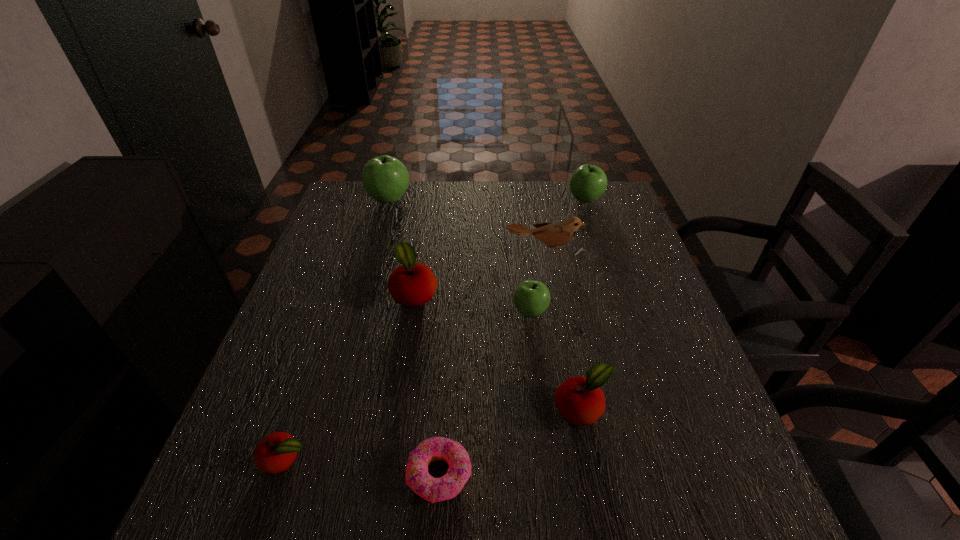
Identify which green apple is the second closest to the pink doughnut. Please provide its 2D coordinates. Your answer should be formatted as a tuple, i.e. [(x, y)], where the tuple contains the x and y coordinates of a point satisfying the conditions above.

[(385, 178)]

At what (x,y) coordinates should I click in order to perform the action: click on red apple that is the closest one to the nearest green apple. Please return your answer as a coordinate pair (x, y). This screenshot has width=960, height=540. Looking at the image, I should click on (580, 401).

Identify the location of red apple that stands as the second closest to the rightmost apple. (580, 401).

Where is `vacant region that satisfies the following two spatial constraints: 1. on the back side of the smallest red apple; 2. on the right side of the biggest green apple`? The width and height of the screenshot is (960, 540). vacant region that satisfies the following two spatial constraints: 1. on the back side of the smallest red apple; 2. on the right side of the biggest green apple is located at coordinates (372, 199).

The image size is (960, 540). What are the coordinates of `free space that satisfies the following two spatial constraints: 1. on the front side of the biggest red apple; 2. on the left side of the smallest green apple` in the screenshot? It's located at pyautogui.click(x=412, y=312).